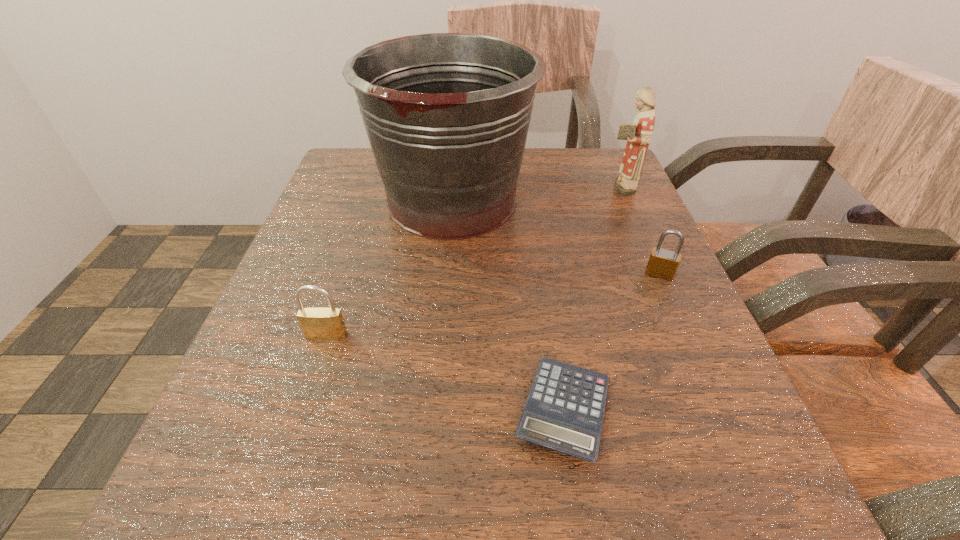
This screenshot has height=540, width=960. In order to click on vacant space at the far left corner in this screenshot , I will do `click(365, 161)`.

This screenshot has height=540, width=960. I want to click on vacant space at the near left corner, so click(172, 519).

The height and width of the screenshot is (540, 960). In the image, there is a desktop. What are the coordinates of `free space at the far right corner` in the screenshot? It's located at (569, 156).

You are a GUI agent. You are given a task and a screenshot of the screen. Output one action in this format:
    pyautogui.click(x=<x>, y=<y>)
    Task: Click on the free space at the near right corner of the desktop
    The height and width of the screenshot is (540, 960).
    Given the screenshot: What is the action you would take?
    pyautogui.click(x=780, y=507)

This screenshot has height=540, width=960. Identify the location of vacant space in between the fourth farthest object and the second tallest object. (472, 261).

The height and width of the screenshot is (540, 960). In order to click on free space between the fourth farthest object and the third nearest object in this screenshot , I will do `click(493, 305)`.

The height and width of the screenshot is (540, 960). What are the coordinates of `free area in between the farther padlock and the figurine` in the screenshot? It's located at click(x=639, y=231).

Image resolution: width=960 pixels, height=540 pixels. What are the coordinates of `unoccupied area between the second tallest object and the nearest object` in the screenshot? It's located at (591, 299).

Locate an element on the screen. Image resolution: width=960 pixels, height=540 pixels. vacant region between the figurine and the tallest object is located at coordinates (536, 194).

I want to click on free spot between the calculator and the farther padlock, so click(612, 342).